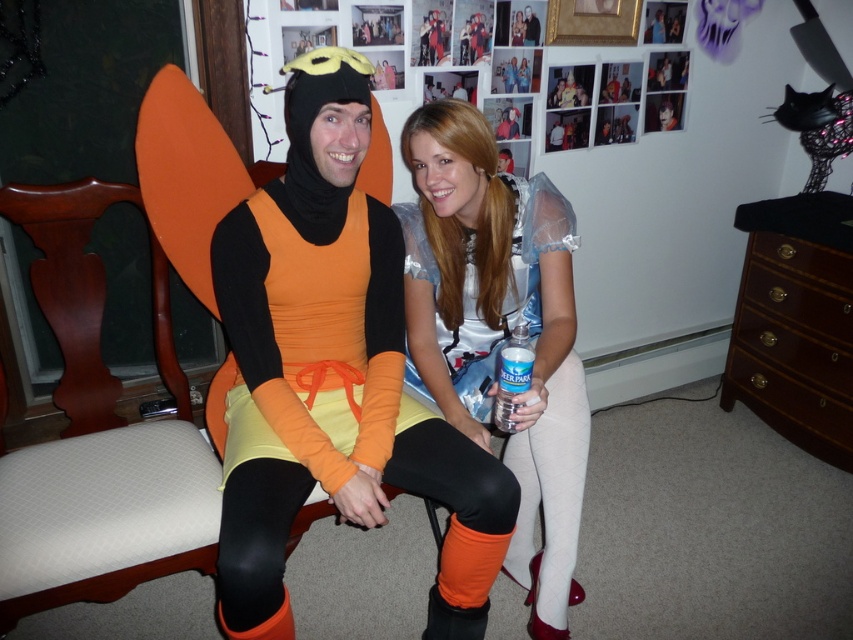
Which is above, matte orange costume at center or matte black costume at center?

Positioned higher is matte black costume at center.

Between matte orange costume at center and matte black costume at center, which one appears on the left side from the viewer's perspective?

From the viewer's perspective, matte orange costume at center appears more on the left side.

Measure the distance between point (434, 618) and camera.

They are 4.58 feet apart.

Where is `matte orange costume at center`? This screenshot has height=640, width=853. matte orange costume at center is located at coordinates (334, 372).

Can you confirm if matte orange costume at center is positioned to the left of matte silver dress at center?

Correct, you'll find matte orange costume at center to the left of matte silver dress at center.

Based on the photo, is matte orange costume at center closer to camera compared to matte silver dress at center?

Yes, matte orange costume at center is in front of matte silver dress at center.

Which is in front, point (264, 317) or point (480, 211)?

Point (264, 317) is in front.

The width and height of the screenshot is (853, 640). I want to click on matte orange costume at center, so 334,372.

Is matte silver dress at center above matte black costume at center?

No, matte silver dress at center is not above matte black costume at center.

Is point (485, 364) positioned before point (529, 29)?

Yes, point (485, 364) is in front of point (529, 29).

Locate an element on the screen. matte silver dress at center is located at coordinates (498, 330).